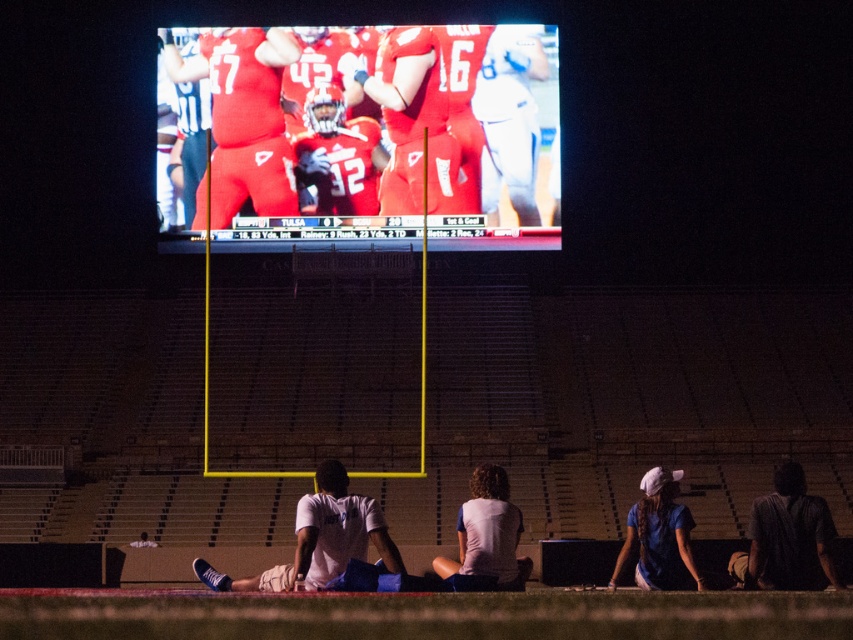
You are a photographer at the stadium and want to capture both the matte red jersey at upper center and the blue cotton shirt at lower right in a single shot. Which jersey should you zoom in on more to ensure both are visible clearly?

The matte red jersey at upper center is smaller than the blue cotton shirt at lower right, so you should zoom in more on the blue cotton shirt at lower right to ensure both are visible clearly.